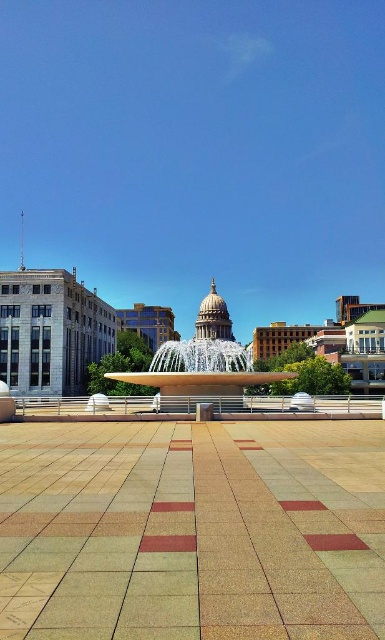
You are a city planner assessing the layout of the plaza. The city has a regulation that requires a minimum of 30 meters of open space between any two public amenities to ensure safety and accessibility. Given the distance between the brown textured tiles at center and the white glossy fountain at center, does this comply with the regulation?

The distance between the brown textured tiles at center and the white glossy fountain at center is 31.24 meters, which exceeds the required 30 meters, so it complies with the regulation.

You are a city planner reviewing the plaza layout. The brown textured tiles at center and the white glossy fountain at center are both key elements. Based on their positions, which one is closer to the ground level?

The brown textured tiles at center are closer to the ground level since they are positioned below the white glossy fountain at center.

You are standing in the plaza and want to take a photo of the white glossy fountain at center without any obstruction. Are the brown textured tiles at center blocking your view of the fountain?

The brown textured tiles at center are in front of the white glossy fountain at center, so they are blocking the view of the fountain.